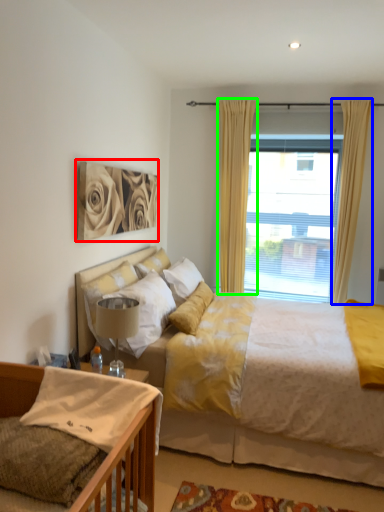
Question: Estimate the real-world distances between objects in this image. Which object is farther from picture frame (highlighted by a red box), curtain (highlighted by a blue box) or curtain (highlighted by a green box)?

Choices:
 (A) curtain
 (B) curtain

Answer: (A)